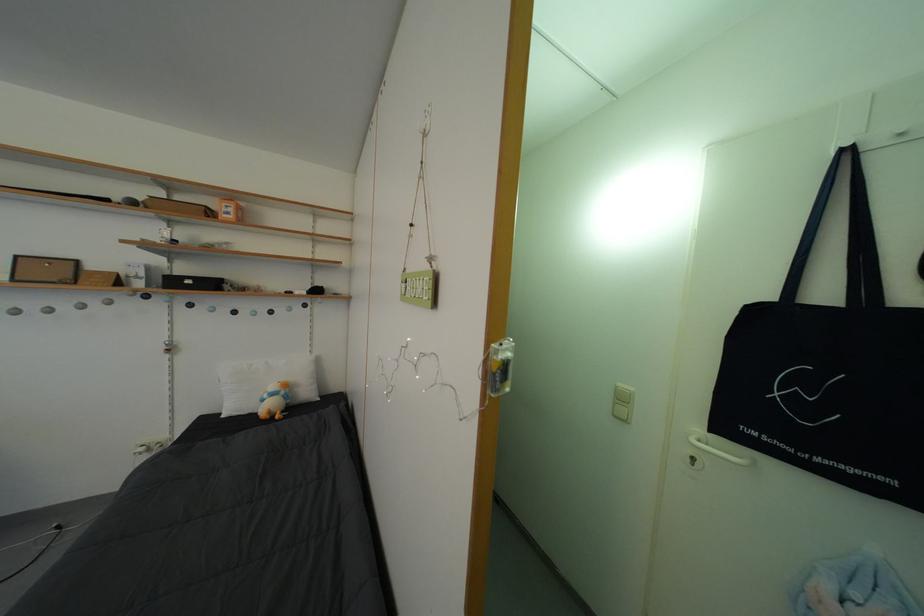
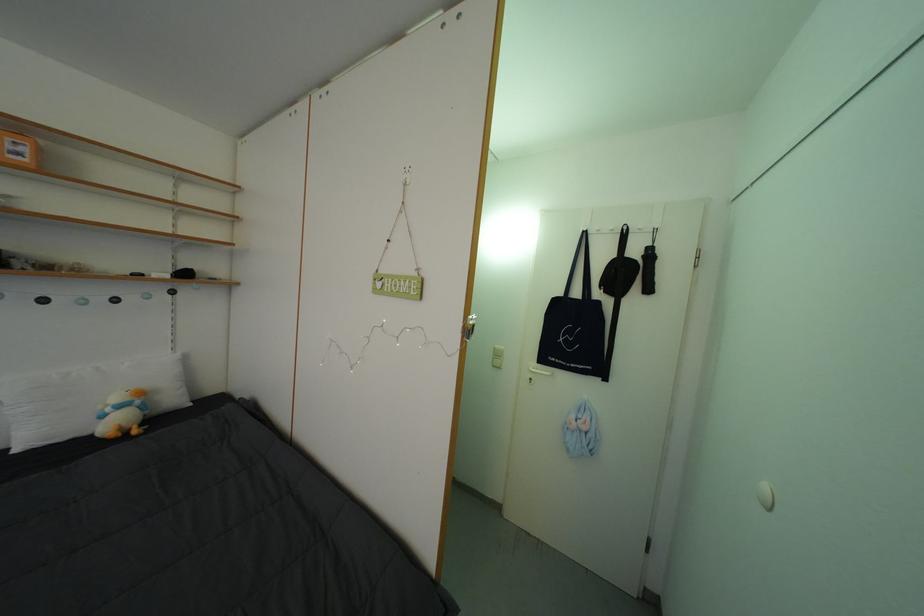
The point at (274, 400) is marked in the first image. Where is the corresponding point in the second image?

(117, 415)